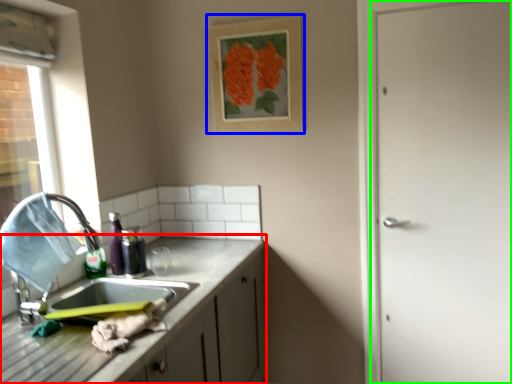
Question: Which is nearer to the cabinetry (highlighted by a red box)? picture frame (highlighted by a blue box) or door (highlighted by a green box).

Choices:
 (A) picture frame
 (B) door

Answer: (A)